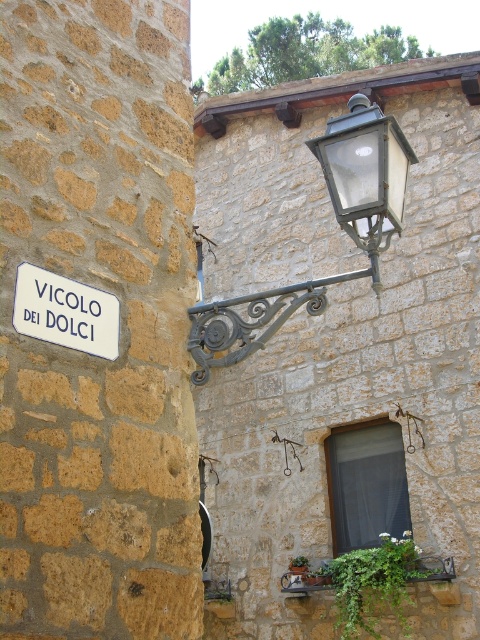
Question: Which object is positioned closest to the white matte street sign at lower left?

Choices:
 (A) matte glass streetlight at upper right
 (B) matte black lantern at upper center

Answer: (B)

Question: Which point is farther to the camera?

Choices:
 (A) white matte street sign at lower left
 (B) matte black lantern at upper center
 (C) matte glass streetlight at upper right

Answer: (C)

Question: Can you confirm if matte glass streetlight at upper right is smaller than white matte street sign at lower left?

Choices:
 (A) no
 (B) yes

Answer: (A)

Question: Does matte black lantern at upper center have a larger size compared to white matte street sign at lower left?

Choices:
 (A) no
 (B) yes

Answer: (B)

Question: Does matte black lantern at upper center lie behind white matte street sign at lower left?

Choices:
 (A) yes
 (B) no

Answer: (A)

Question: Among these objects, which one is farthest from the camera?

Choices:
 (A) matte glass streetlight at upper right
 (B) white matte street sign at lower left
 (C) matte black lantern at upper center

Answer: (A)